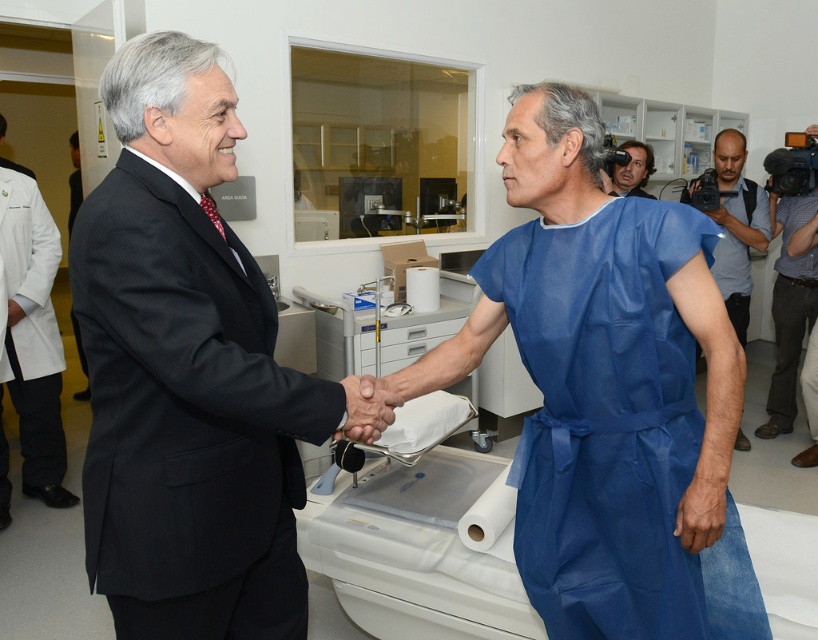
Between blue scrubs at center and blue fabric gown at center, which one has less height?

With less height is blue fabric gown at center.

Is blue scrubs at center to the right of blue fabric gown at center from the viewer's perspective?

No, blue scrubs at center is not to the right of blue fabric gown at center.

Does point (149, 115) come behind point (628, 179)?

No.

You are a GUI agent. You are given a task and a screenshot of the screen. Output one action in this format:
    pyautogui.click(x=<x>, y=<y>)
    Task: Click on the blue scrubs at center
    This screenshot has height=640, width=818.
    Given the screenshot: What is the action you would take?
    pyautogui.click(x=189, y=372)

Is blue scrubs at center thinner than blue scrubs at right?

Incorrect, blue scrubs at center's width is not less than blue scrubs at right's.

Is point (218, 218) more distant than point (758, 193)?

No, it is not.

I want to click on blue scrubs at center, so click(189, 372).

Who is more distant from viewer, (x=730, y=163) or (x=636, y=148)?

The point (x=636, y=148) is behind.

Does blue scrubs at right appear under blue fabric gown at center?

Yes, blue scrubs at right is below blue fabric gown at center.

This screenshot has width=818, height=640. What do you see at coordinates (736, 227) in the screenshot? I see `blue scrubs at right` at bounding box center [736, 227].

Locate an element on the screen. blue scrubs at right is located at coordinates (736, 227).